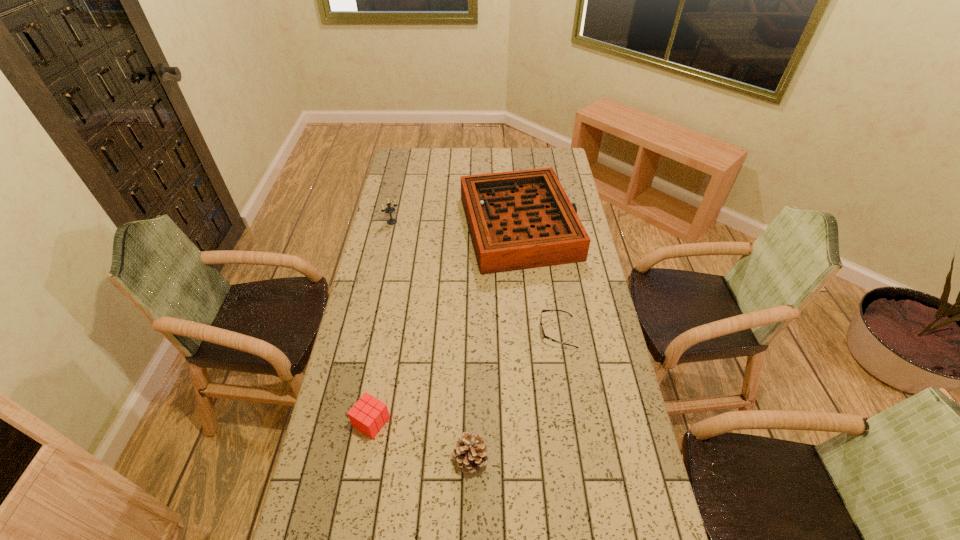
This screenshot has height=540, width=960. Find the location of `free space at the right edge of the desktop`. free space at the right edge of the desktop is located at coordinates (559, 173).

Where is `free space at the far left corner of the desktop`? This screenshot has height=540, width=960. free space at the far left corner of the desktop is located at coordinates (397, 168).

Find the location of `free space between the nearest object and the sunglasses`. free space between the nearest object and the sunglasses is located at coordinates (515, 395).

Identify the location of unoccupied area between the fourth farthest object and the candle holder. This screenshot has width=960, height=540. pos(382,322).

Identify the location of empty location between the cube and the pinecone. The image size is (960, 540). (421, 440).

Identify the location of vacant area that lies between the gameboard and the shortest object. The height and width of the screenshot is (540, 960). (539, 279).

The height and width of the screenshot is (540, 960). What are the coordinates of `free space between the pinecone and the candle holder` in the screenshot? It's located at (431, 340).

Locate an element on the screen. free space that is in between the shortest object and the candle holder is located at coordinates (474, 277).

Where is `free space between the fourth farthest object and the gameboard`? free space between the fourth farthest object and the gameboard is located at coordinates (445, 325).

The height and width of the screenshot is (540, 960). In order to click on vacant area between the cube and the nearest object in this screenshot , I will do `click(421, 440)`.